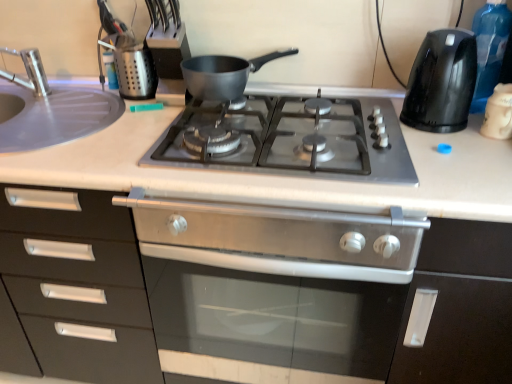
This screenshot has height=384, width=512. Find the location of `free location in front of black plastic kettle at right, which ranks as the second kitchen appliance in left-to-right order`. free location in front of black plastic kettle at right, which ranks as the second kitchen appliance in left-to-right order is located at coordinates (461, 160).